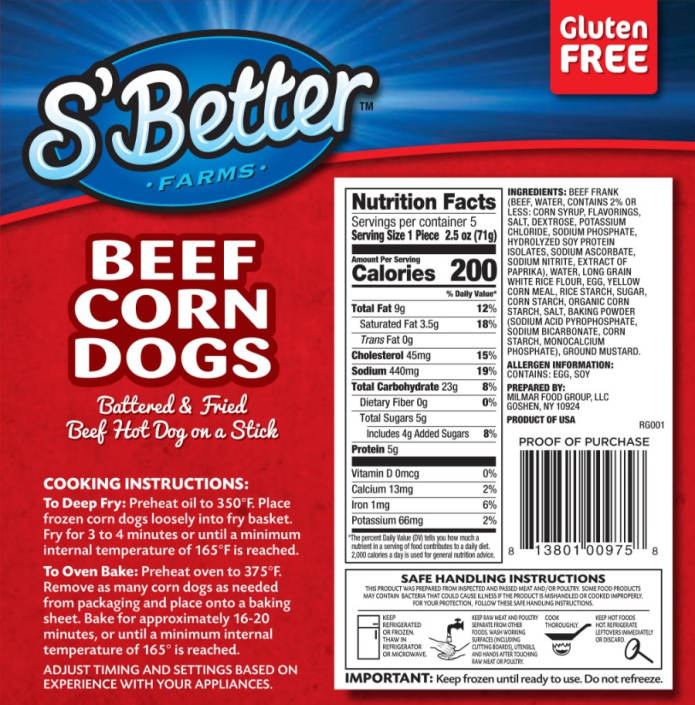
Image resolution: width=695 pixels, height=705 pixels. In order to click on refrigerator icon in this screenshot , I will do `click(374, 644)`.